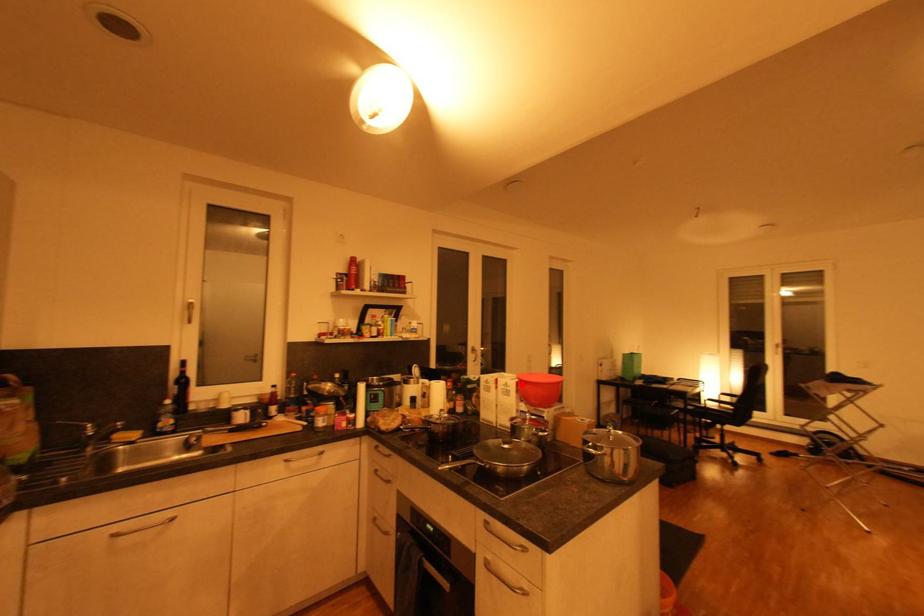
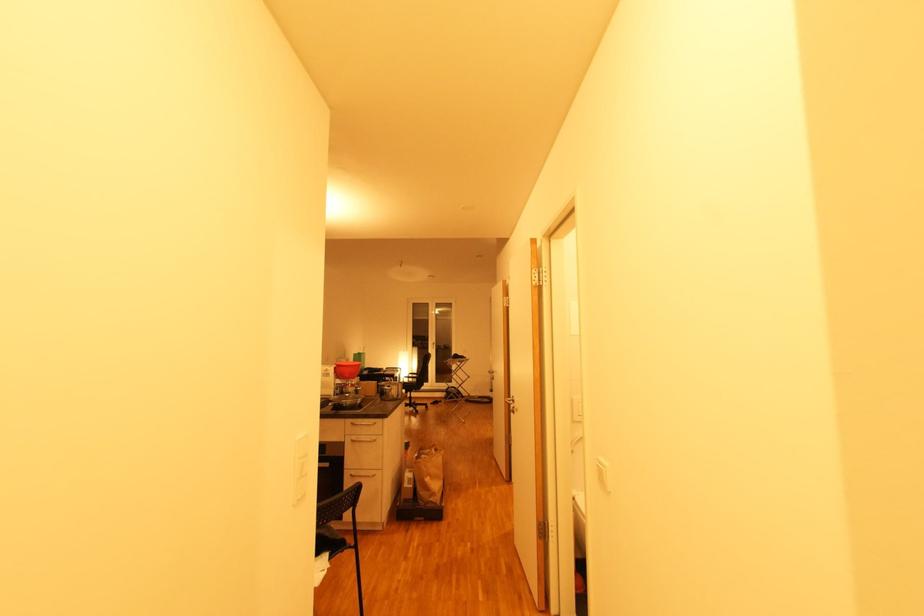
Question: I am providing you with two images of the same scene from different viewpoints. A red point is shown in image1. For the corresponding object point in image2, is it positioned nearer or farther from the camera?

Choices:
 (A) Nearer
 (B) Farther

Answer: (A)